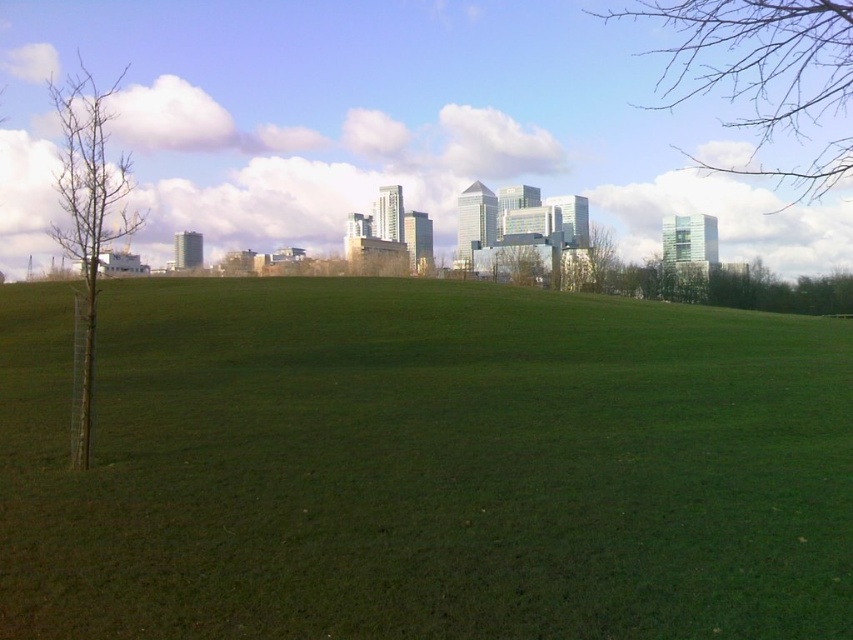
You are a gardener planning to plant a new flower bed between the green grass at center and the bare branches at upper right. Based on their positions, where should the flower bed be placed?

The flower bed should be placed between the green grass at center and the bare branches at upper right since the green grass at center is located below the bare branches at upper right.

Consider the image. You are a bird looking for a nesting spot. You see the bare branches at upper right and the green leafy tree at center. Which one is taller?

The bare branches at upper right has a greater height compared to the green leafy tree at center, so the bare branches at upper right is taller.

Based on the photo, you are an urban planner assessing the view from a new park. You notice the bare branches at upper right and the green leafy tree at center. Which tree would block more sunlight if they were both directly in front of the sun?

The bare branches at upper right is larger in size than the green leafy tree at center, so it would block more sunlight.